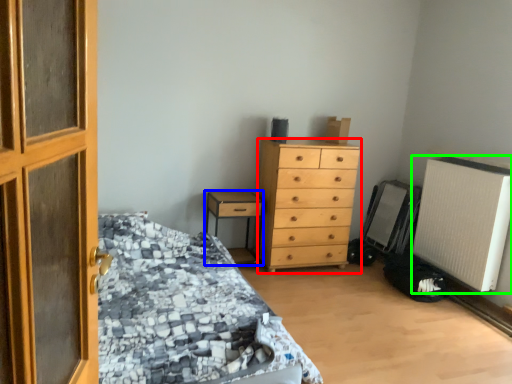
Question: Which object is the farthest from chest of drawers (highlighted by a red box)? Choose among these: nightstand (highlighted by a blue box) or air conditioning (highlighted by a green box).

Choices:
 (A) nightstand
 (B) air conditioning

Answer: (B)